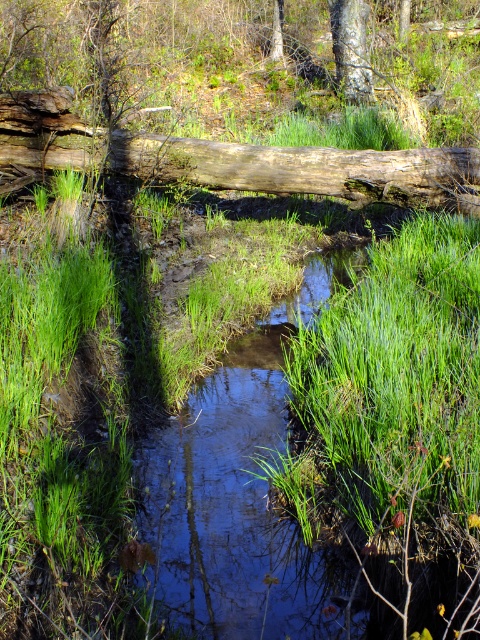
You are a hiker trying to cross the stream. You see the weathered brown log at center and the smooth gray tree trunk at upper center. Which object is closer to the left bank of the stream?

The weathered brown log at center is positioned on the left side of smooth gray tree trunk at upper center, so it is closer to the left bank of the stream.

You are standing at the edge of the stream and want to cross to the other side. The weathered brown log at center is the only path available. If your maximum comfortable walking distance on a narrow surface is 4 meters, can you safely cross using the log?

The weathered brown log at center is 5.07 meters from the camera, which is longer than your maximum comfortable walking distance of 4 meters. Therefore, crossing the log may not be safe due to its length exceeding your comfort zone.

You are standing at the edge of the stream and want to walk to the log. You notice two points marked on the log. Which point is closer to you, point (291, 326) or point (384, 186)?

Point (291, 326) is closer to the viewer than point (384, 186), so the closer point is point (291, 326).